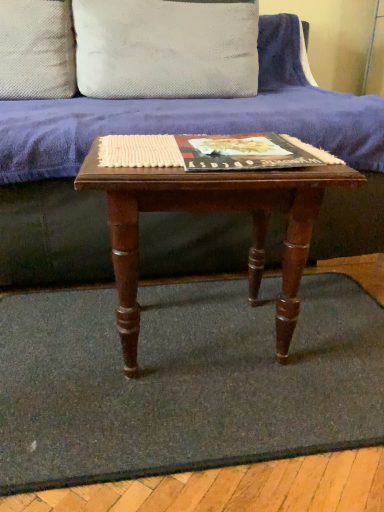
Question: Is matte hardcover book at center touching velvet purple couch at center?

Choices:
 (A) no
 (B) yes

Answer: (A)

Question: Can you confirm if matte hardcover book at center is positioned to the right of velvet purple couch at center?

Choices:
 (A) no
 (B) yes

Answer: (B)

Question: Considering the relative sizes of matte hardcover book at center and velvet purple couch at center in the image provided, is matte hardcover book at center taller than velvet purple couch at center?

Choices:
 (A) no
 (B) yes

Answer: (A)

Question: Is matte hardcover book at center oriented towards velvet purple couch at center?

Choices:
 (A) no
 (B) yes

Answer: (A)

Question: Is matte hardcover book at center wider than velvet purple couch at center?

Choices:
 (A) no
 (B) yes

Answer: (A)

Question: From a real-world perspective, is matte hardcover book at center positioned under velvet purple couch at center based on gravity?

Choices:
 (A) yes
 (B) no

Answer: (B)

Question: Is white dotted fabric pillow at upper center, acting as the first pillow starting from the left, far away from velvet purple couch at center?

Choices:
 (A) yes
 (B) no

Answer: (B)

Question: Could you tell me if white dotted fabric pillow at upper center, acting as the first pillow starting from the left, is facing velvet purple couch at center?

Choices:
 (A) no
 (B) yes

Answer: (B)

Question: Is white dotted fabric pillow at upper center, acting as the first pillow starting from the left, thinner than velvet purple couch at center?

Choices:
 (A) no
 (B) yes

Answer: (B)

Question: Can you confirm if white dotted fabric pillow at upper center, acting as the first pillow starting from the left, is positioned to the right of velvet purple couch at center?

Choices:
 (A) yes
 (B) no

Answer: (B)

Question: Considering the relative sizes of white dotted fabric pillow at upper center, acting as the first pillow starting from the left, and velvet purple couch at center in the image provided, is white dotted fabric pillow at upper center, acting as the first pillow starting from the left, shorter than velvet purple couch at center?

Choices:
 (A) no
 (B) yes

Answer: (B)

Question: Is white dotted fabric pillow at upper center, positioned as the second pillow in right-to-left order, taller than velvet purple couch at center?

Choices:
 (A) yes
 (B) no

Answer: (B)

Question: Is matte hardcover book at center positioned in front of wooden table at center?

Choices:
 (A) no
 (B) yes

Answer: (A)